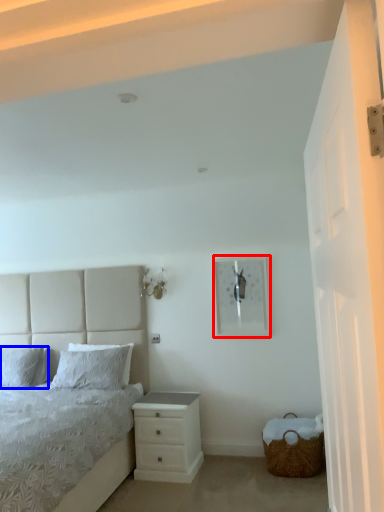
Question: Which object appears closest to the camera in this image, picture frame (highlighted by a red box) or pillow (highlighted by a blue box)?

Choices:
 (A) picture frame
 (B) pillow

Answer: (A)